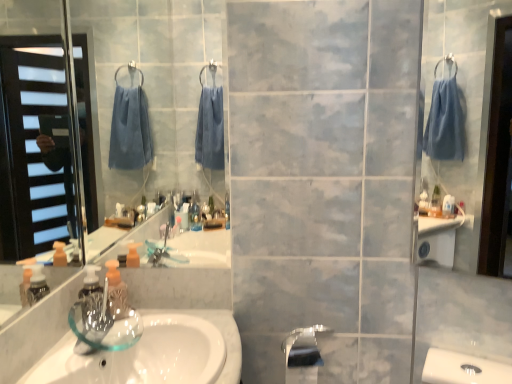
Question: Would you say transparent glass soap dispenser at lower left contains white glossy sink at lower left?

Choices:
 (A) yes
 (B) no

Answer: (B)

Question: Can we say transparent glass soap dispenser at lower left lies outside white glossy sink at lower left?

Choices:
 (A) no
 (B) yes

Answer: (B)

Question: From a real-world perspective, is transparent glass soap dispenser at lower left located beneath white glossy sink at lower left?

Choices:
 (A) no
 (B) yes

Answer: (A)

Question: Could you tell me if transparent glass soap dispenser at lower left is facing white glossy sink at lower left?

Choices:
 (A) yes
 (B) no

Answer: (B)

Question: Can you confirm if transparent glass soap dispenser at lower left is bigger than white glossy sink at lower left?

Choices:
 (A) no
 (B) yes

Answer: (A)

Question: Considering their positions, is white glossy sink at lower left located in front of or behind satin nickel faucet at lower center?

Choices:
 (A) front
 (B) behind

Answer: (A)

Question: Is point (54, 359) positioned closer to the camera than point (283, 347)?

Choices:
 (A) farther
 (B) closer

Answer: (B)

Question: Is white glossy sink at lower left to the left or to the right of satin nickel faucet at lower center in the image?

Choices:
 (A) right
 (B) left

Answer: (B)

Question: Is white glossy sink at lower left situated inside satin nickel faucet at lower center or outside?

Choices:
 (A) inside
 (B) outside

Answer: (B)

Question: Looking at the image, does satin nickel faucet at lower center seem bigger or smaller compared to white glossy sink at lower left?

Choices:
 (A) small
 (B) big

Answer: (A)

Question: From the image's perspective, is satin nickel faucet at lower center positioned above or below white glossy sink at lower left?

Choices:
 (A) below
 (B) above

Answer: (A)

Question: Considering their positions, is satin nickel faucet at lower center located in front of or behind white glossy sink at lower left?

Choices:
 (A) front
 (B) behind

Answer: (B)

Question: Is satin nickel faucet at lower center taller or shorter than white glossy sink at lower left?

Choices:
 (A) short
 (B) tall

Answer: (B)

Question: Is white glossy sink at lower left to the left or to the right of transparent glass soap dispenser at lower left in the image?

Choices:
 (A) right
 (B) left

Answer: (A)

Question: From the image's perspective, is white glossy sink at lower left positioned above or below transparent glass soap dispenser at lower left?

Choices:
 (A) above
 (B) below

Answer: (B)